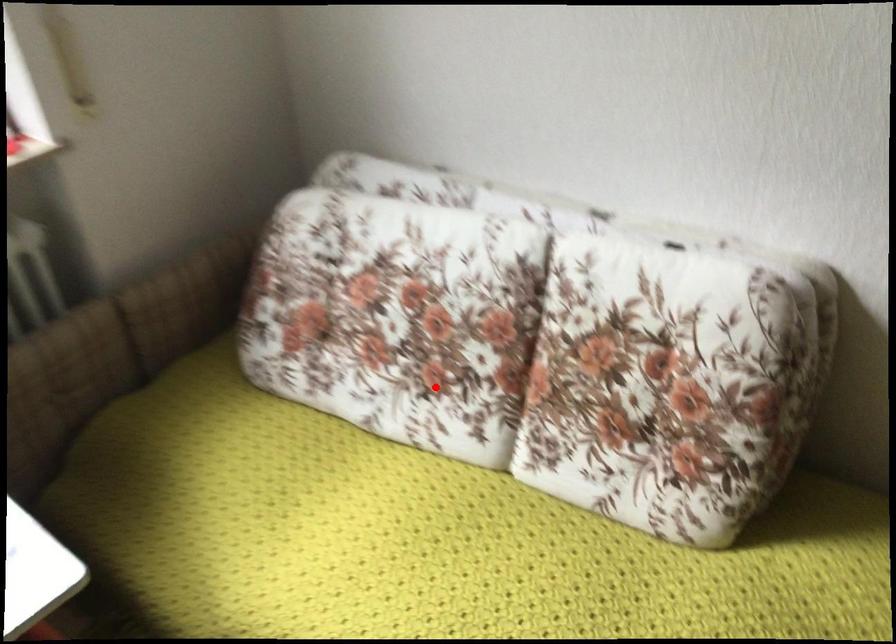
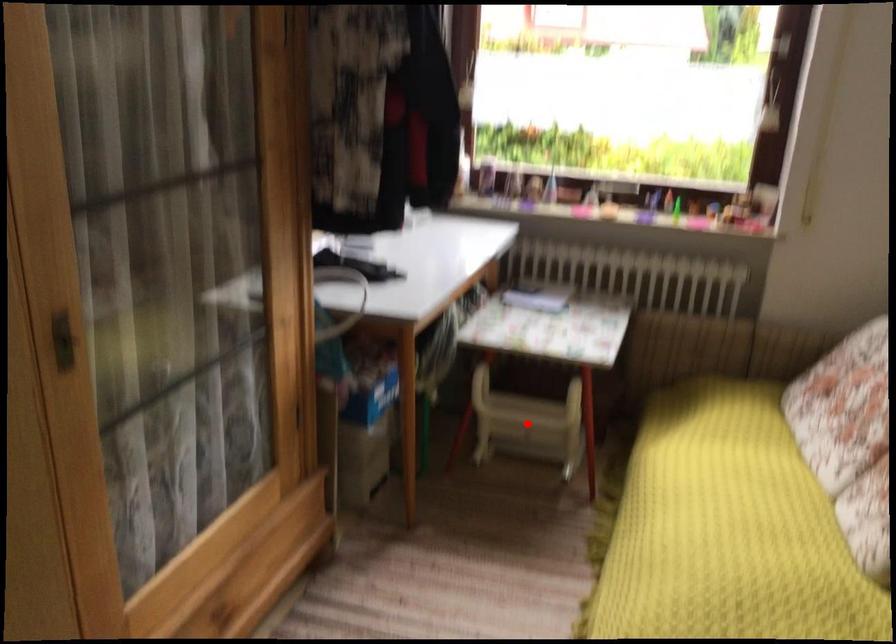
I am providing you with two images of the same scene from different viewpoints. A red point is marked on the first image and another point is marked on the second image. Is the marked point in image1 the same physical position as the marked point in image2?

No